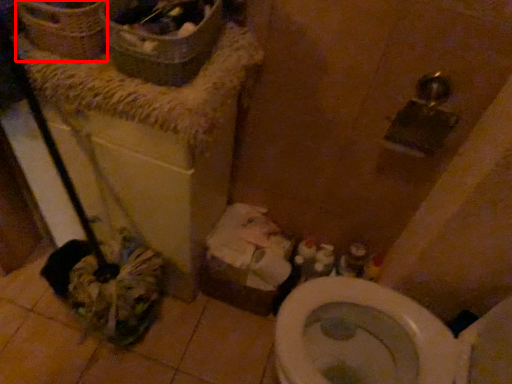
Question: From the image's perspective, what is the correct spatial positioning of basket (annotated by the red box) in reference to cardboard box?

Choices:
 (A) below
 (B) above

Answer: (B)